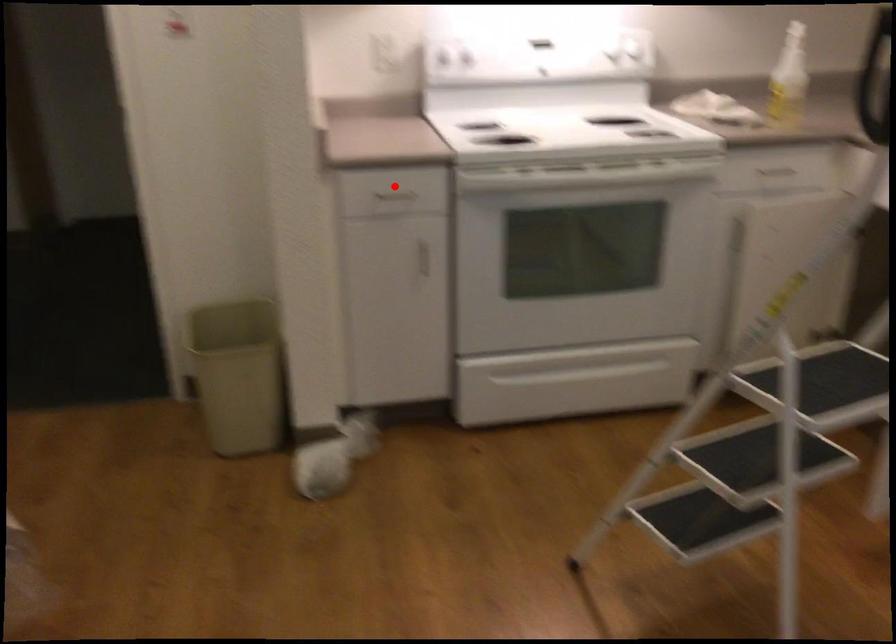
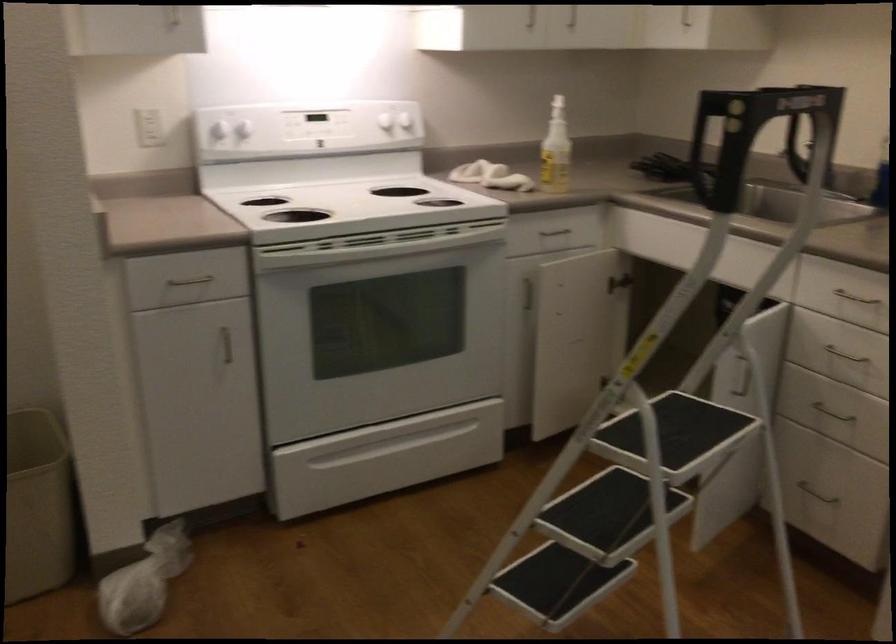
Question: I am providing you with two images of the same scene from different viewpoints. In image1, a red point is highlighted. Considering the same 3D point in image2, which of the following is correct?

Choices:
 (A) It is closer
 (B) It is farther

Answer: (A)